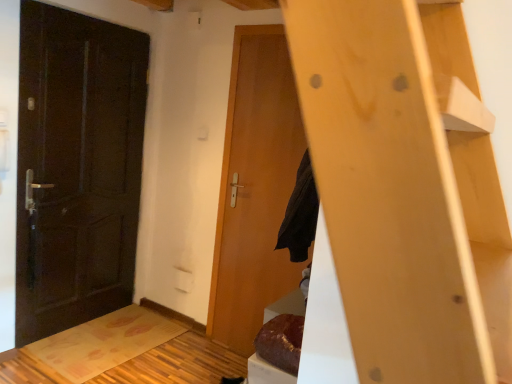
In the scene shown: What is the approximate width of wooden door at center, which appears as the 2th door when viewed from the left?

wooden door at center, which appears as the 2th door when viewed from the left, is 0.89 inches in width.

Where is `wooden door at center, which is counted as the 1th door, starting from the right`? wooden door at center, which is counted as the 1th door, starting from the right is located at coordinates (255, 187).

Describe the element at coordinates (255, 187) in the screenshot. The height and width of the screenshot is (384, 512). I see `wooden door at center, which is counted as the 1th door, starting from the right` at that location.

The width and height of the screenshot is (512, 384). What do you see at coordinates (77, 167) in the screenshot? I see `matte dark brown door at left, acting as the 2th door starting from the right` at bounding box center [77, 167].

This screenshot has height=384, width=512. I want to click on matte dark brown door at left, which is the 1th door in left-to-right order, so click(x=77, y=167).

The image size is (512, 384). Identify the location of wooden door at center, which is counted as the 1th door, starting from the right. (255, 187).

Can you confirm if matte dark brown door at left, acting as the 2th door starting from the right, is positioned to the right of wooden door at center, which is counted as the 1th door, starting from the right?

Incorrect, matte dark brown door at left, acting as the 2th door starting from the right, is not on the right side of wooden door at center, which is counted as the 1th door, starting from the right.

Considering the positions of objects matte dark brown door at left, acting as the 2th door starting from the right, and wooden door at center, which appears as the 2th door when viewed from the left, in the image provided, who is behind, matte dark brown door at left, acting as the 2th door starting from the right, or wooden door at center, which appears as the 2th door when viewed from the left,?

wooden door at center, which appears as the 2th door when viewed from the left, is behind.

Considering the positions of points (111, 96) and (274, 168), is point (111, 96) closer to camera compared to point (274, 168)?

No, it is behind (274, 168).

From the image's perspective, which one is positioned higher, matte dark brown door at left, which is the 1th door in left-to-right order, or wooden door at center, which is counted as the 1th door, starting from the right?

From the image's view, matte dark brown door at left, which is the 1th door in left-to-right order, is above.

From a real-world perspective, who is located higher, matte dark brown door at left, acting as the 2th door starting from the right, or wooden door at center, which is counted as the 1th door, starting from the right?

matte dark brown door at left, acting as the 2th door starting from the right.

Considering the sizes of objects matte dark brown door at left, acting as the 2th door starting from the right, and wooden door at center, which appears as the 2th door when viewed from the left, in the image provided, who is wider, matte dark brown door at left, acting as the 2th door starting from the right, or wooden door at center, which appears as the 2th door when viewed from the left,?

matte dark brown door at left, acting as the 2th door starting from the right, is wider.

From the picture: In terms of height, does matte dark brown door at left, acting as the 2th door starting from the right, look taller or shorter compared to wooden door at center, which is counted as the 1th door, starting from the right?

matte dark brown door at left, acting as the 2th door starting from the right, is shorter than wooden door at center, which is counted as the 1th door, starting from the right.

Can you confirm if matte dark brown door at left, which is the 1th door in left-to-right order, is smaller than wooden door at center, which is counted as the 1th door, starting from the right?

No, matte dark brown door at left, which is the 1th door in left-to-right order, is not smaller than wooden door at center, which is counted as the 1th door, starting from the right.

Would you say matte dark brown door at left, which is the 1th door in left-to-right order, is inside or outside wooden door at center, which is counted as the 1th door, starting from the right?

matte dark brown door at left, which is the 1th door in left-to-right order, is outside wooden door at center, which is counted as the 1th door, starting from the right.

Can you see matte dark brown door at left, acting as the 2th door starting from the right, touching wooden door at center, which appears as the 2th door when viewed from the left?

No, matte dark brown door at left, acting as the 2th door starting from the right, is not beside wooden door at center, which appears as the 2th door when viewed from the left.

Is matte dark brown door at left, acting as the 2th door starting from the right, oriented towards wooden door at center, which is counted as the 1th door, starting from the right?

Yes, matte dark brown door at left, acting as the 2th door starting from the right, faces towards wooden door at center, which is counted as the 1th door, starting from the right.

From the picture: How different are the orientations of matte dark brown door at left, which is the 1th door in left-to-right order, and wooden door at center, which is counted as the 1th door, starting from the right, in degrees?

The angle between the facing direction of matte dark brown door at left, which is the 1th door in left-to-right order, and the facing direction of wooden door at center, which is counted as the 1th door, starting from the right, is 91.5 degrees.

Find the location of a particular element. door below the matte dark brown door at left, which is the 1th door in left-to-right order (from the image's perspective) is located at coordinates (255, 187).

Which object is positioned more to the left, wooden door at center, which appears as the 2th door when viewed from the left, or matte dark brown door at left, which is the 1th door in left-to-right order?

matte dark brown door at left, which is the 1th door in left-to-right order.

Which object is further away from the camera taking this photo, wooden door at center, which appears as the 2th door when viewed from the left, or matte dark brown door at left, acting as the 2th door starting from the right?

wooden door at center, which appears as the 2th door when viewed from the left, is further from the camera.

Which is closer to the camera, (266, 40) or (117, 97)?

Point (266, 40) is positioned closer to the camera compared to point (117, 97).

From the image's perspective, is wooden door at center, which appears as the 2th door when viewed from the left, located above or below matte dark brown door at left, acting as the 2th door starting from the right?

wooden door at center, which appears as the 2th door when viewed from the left, is below matte dark brown door at left, acting as the 2th door starting from the right.

From a real-world perspective, is wooden door at center, which is counted as the 1th door, starting from the right, positioned above or below matte dark brown door at left, acting as the 2th door starting from the right?

wooden door at center, which is counted as the 1th door, starting from the right, is situated lower than matte dark brown door at left, acting as the 2th door starting from the right, in the real world.

Does wooden door at center, which appears as the 2th door when viewed from the left, have a greater width compared to matte dark brown door at left, acting as the 2th door starting from the right?

Incorrect, the width of wooden door at center, which appears as the 2th door when viewed from the left, does not surpass that of matte dark brown door at left, acting as the 2th door starting from the right.

Is wooden door at center, which appears as the 2th door when viewed from the left, taller than matte dark brown door at left, acting as the 2th door starting from the right?

Indeed, wooden door at center, which appears as the 2th door when viewed from the left, has a greater height compared to matte dark brown door at left, acting as the 2th door starting from the right.

Considering the sizes of objects wooden door at center, which appears as the 2th door when viewed from the left, and matte dark brown door at left, which is the 1th door in left-to-right order, in the image provided, who is bigger, wooden door at center, which appears as the 2th door when viewed from the left, or matte dark brown door at left, which is the 1th door in left-to-right order,?

matte dark brown door at left, which is the 1th door in left-to-right order.

Would you say wooden door at center, which appears as the 2th door when viewed from the left, is outside matte dark brown door at left, acting as the 2th door starting from the right?

Yes, wooden door at center, which appears as the 2th door when viewed from the left, is outside of matte dark brown door at left, acting as the 2th door starting from the right.

Is wooden door at center, which appears as the 2th door when viewed from the left, positioned far away from matte dark brown door at left, acting as the 2th door starting from the right?

No, wooden door at center, which appears as the 2th door when viewed from the left, is not far away from matte dark brown door at left, acting as the 2th door starting from the right.

Is wooden door at center, which is counted as the 1th door, starting from the right, oriented towards matte dark brown door at left, which is the 1th door in left-to-right order?

No, wooden door at center, which is counted as the 1th door, starting from the right, does not turn towards matte dark brown door at left, which is the 1th door in left-to-right order.

How many degrees apart are the facing directions of wooden door at center, which appears as the 2th door when viewed from the left, and matte dark brown door at left, which is the 1th door in left-to-right order?

They differ by 91.5 degrees in their facing directions.

Could you measure the distance between wooden door at center, which appears as the 2th door when viewed from the left, and matte dark brown door at left, acting as the 2th door starting from the right?

wooden door at center, which appears as the 2th door when viewed from the left, and matte dark brown door at left, acting as the 2th door starting from the right, are 38.66 inches apart.

Find the location of `door on the left side of wooden door at center, which appears as the 2th door when viewed from the left`. door on the left side of wooden door at center, which appears as the 2th door when viewed from the left is located at coordinates (77, 167).

At what (x,y) coordinates should I click in order to perform the action: click on door in front of the wooden door at center, which appears as the 2th door when viewed from the left. Please return your answer as a coordinate pair (x, y). This screenshot has width=512, height=384. Looking at the image, I should click on (77, 167).

You are a GUI agent. You are given a task and a screenshot of the screen. Output one action in this format:
    pyautogui.click(x=<x>, y=<y>)
    Task: Click on the door on the right of matte dark brown door at left, acting as the 2th door starting from the right
    
    Given the screenshot: What is the action you would take?
    (x=255, y=187)